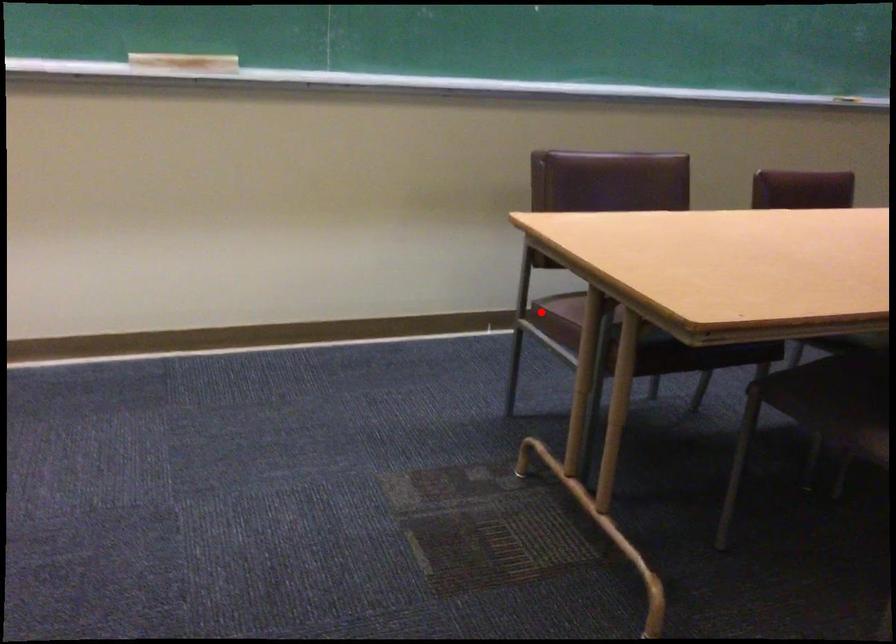
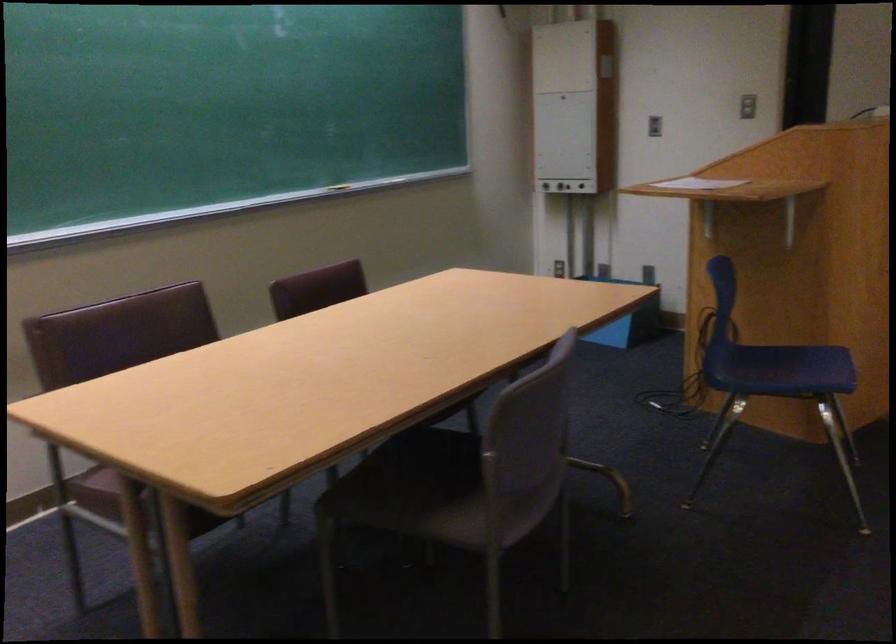
Question: A red point is marked in image1. In image2, is the corresponding 3D point closer to the camera or farther? Reply with the corresponding letter.

Choices:
 (A) The corresponding 3D point is closer.
 (B) The corresponding 3D point is farther.

Answer: (A)